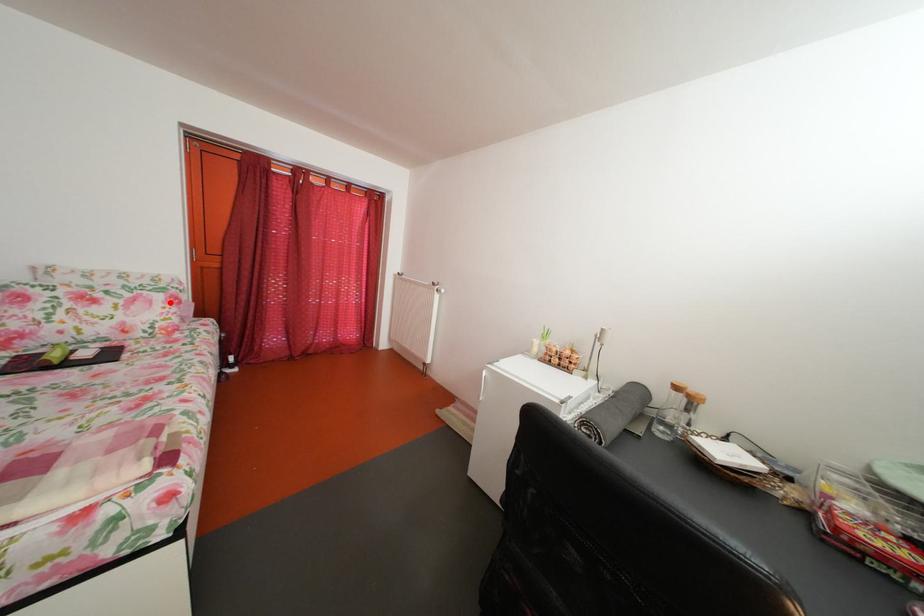
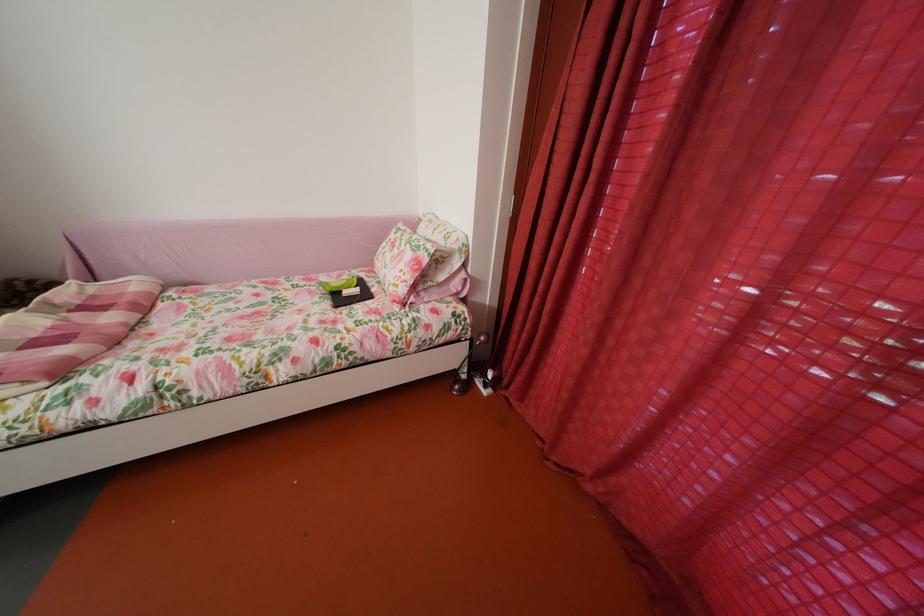
Locate, in the second image, the point that corresponds to the highlighted location in the first image.

(419, 262)